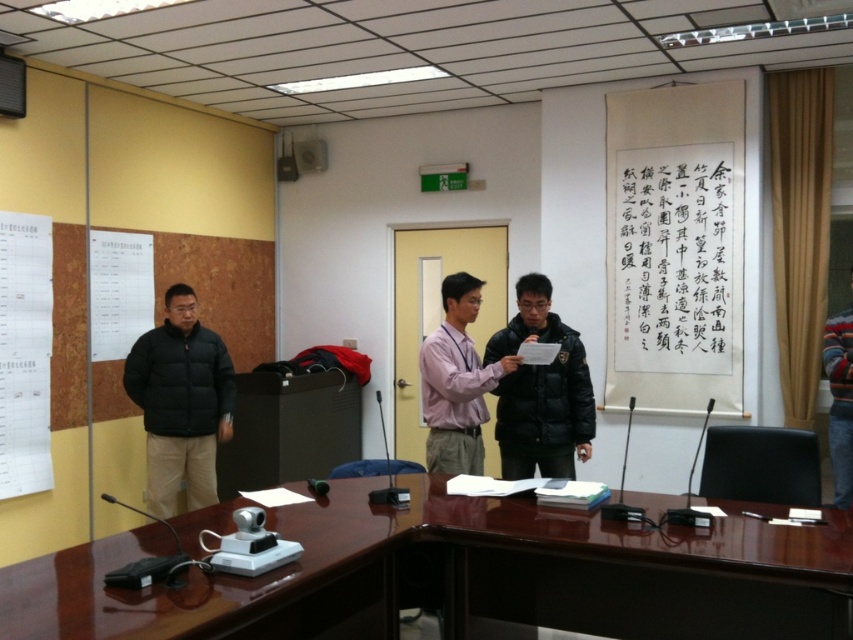
Which is behind, point (155, 513) or point (523, 280)?

Point (155, 513)

Locate an element on the screen. black matte jacket at left is located at coordinates (180, 403).

Can you confirm if white paper at upper right is shorter than black puffy jacket at center?

No, white paper at upper right is not shorter than black puffy jacket at center.

Is white paper at upper right bigger than black puffy jacket at center?

Yes.

Who is more distant from viewer, [619,164] or [543,333]?

The point [619,164] is more distant.

Find the location of a particular element. The width and height of the screenshot is (853, 640). white paper at upper right is located at coordinates (674, 248).

Does brown polished wood table at center come behind white paper at upper right?

No, it is in front of white paper at upper right.

The height and width of the screenshot is (640, 853). I want to click on brown polished wood table at center, so click(x=459, y=576).

In order to click on brown polished wood table at center in this screenshot , I will do `click(459, 576)`.